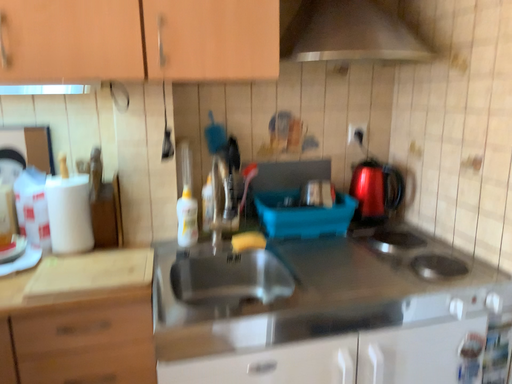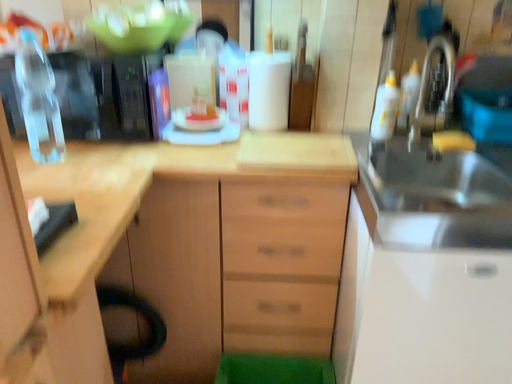
Question: How did the camera likely rotate when shooting the video?

Choices:
 (A) rotated left
 (B) rotated right

Answer: (A)